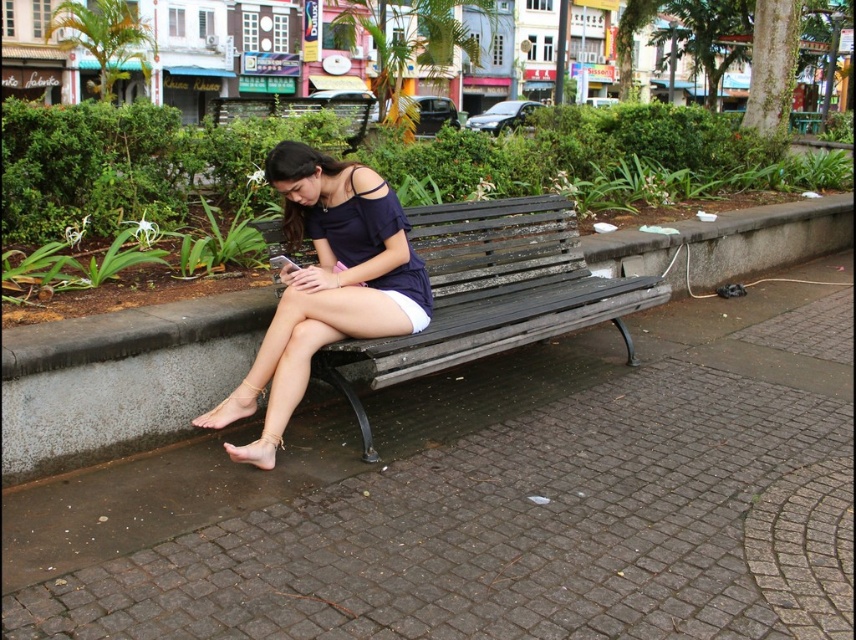
Which is more to the right, dark gray wooden bench at center or matte blue dress at center?

From the viewer's perspective, dark gray wooden bench at center appears more on the right side.

Can you confirm if dark gray wooden bench at center is bigger than matte blue dress at center?

Correct, dark gray wooden bench at center is larger in size than matte blue dress at center.

Describe the element at coordinates (491, 292) in the screenshot. This screenshot has height=640, width=856. I see `dark gray wooden bench at center` at that location.

Where is `dark gray wooden bench at center`? This screenshot has height=640, width=856. dark gray wooden bench at center is located at coordinates (491, 292).